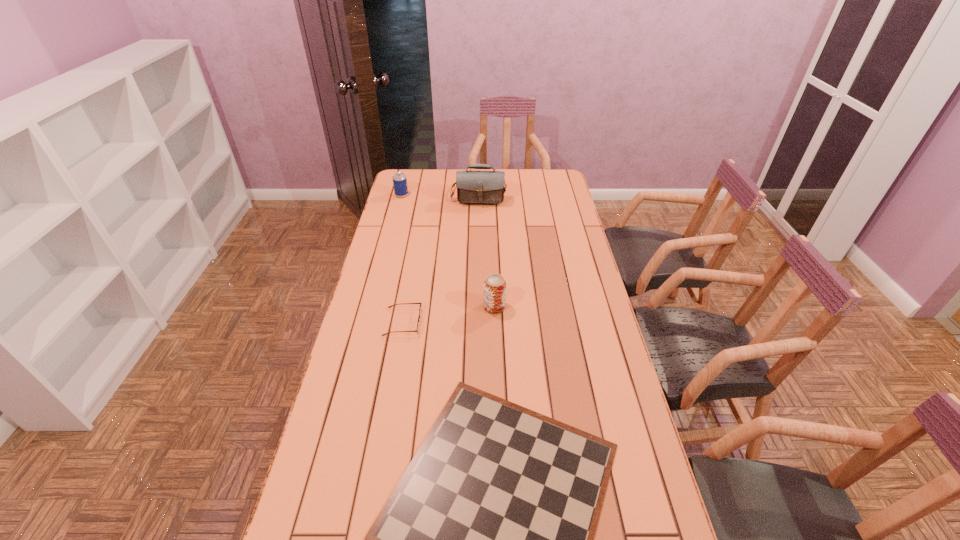
Find the location of a particular element. The height and width of the screenshot is (540, 960). beer can located at the far edge is located at coordinates click(399, 178).

Where is `beer can at the left edge`? This screenshot has height=540, width=960. beer can at the left edge is located at coordinates (399, 178).

This screenshot has width=960, height=540. I want to click on spectacles positioned at the left edge, so click(x=419, y=316).

At what (x,y) coordinates should I click in order to perform the action: click on object situated at the far left corner. Please return your answer as a coordinate pair (x, y). This screenshot has height=540, width=960. Looking at the image, I should click on (399, 178).

Where is `free region at the left edge of the desktop`? This screenshot has width=960, height=540. free region at the left edge of the desktop is located at coordinates (387, 413).

In the image, there is a desktop. In order to click on vacant space at the right edge in this screenshot , I will do `click(605, 332)`.

Find the location of `vacant space at the far right corner of the desktop`. vacant space at the far right corner of the desktop is located at coordinates (554, 174).

Find the location of a particular element. free point between the shoulder bag and the right beer can is located at coordinates click(487, 249).

Where is `free space that is in between the farther beer can and the nearer beer can`? The width and height of the screenshot is (960, 540). free space that is in between the farther beer can and the nearer beer can is located at coordinates (448, 251).

Where is `vacant region between the leftmost object and the spectacles`? This screenshot has height=540, width=960. vacant region between the leftmost object and the spectacles is located at coordinates (402, 259).